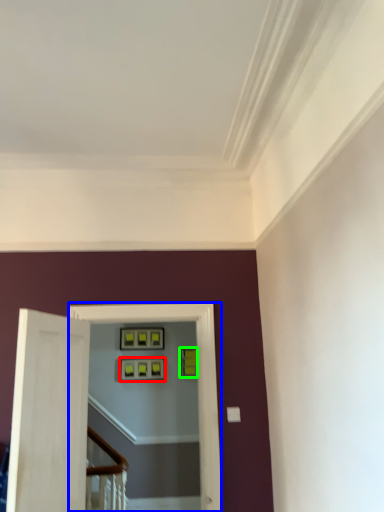
Question: Based on their relative distances, which object is nearer to picture frame (highlighted by a red box)? Choose from passage (highlighted by a blue box) and picture frame (highlighted by a green box).

Choices:
 (A) passage
 (B) picture frame

Answer: (B)